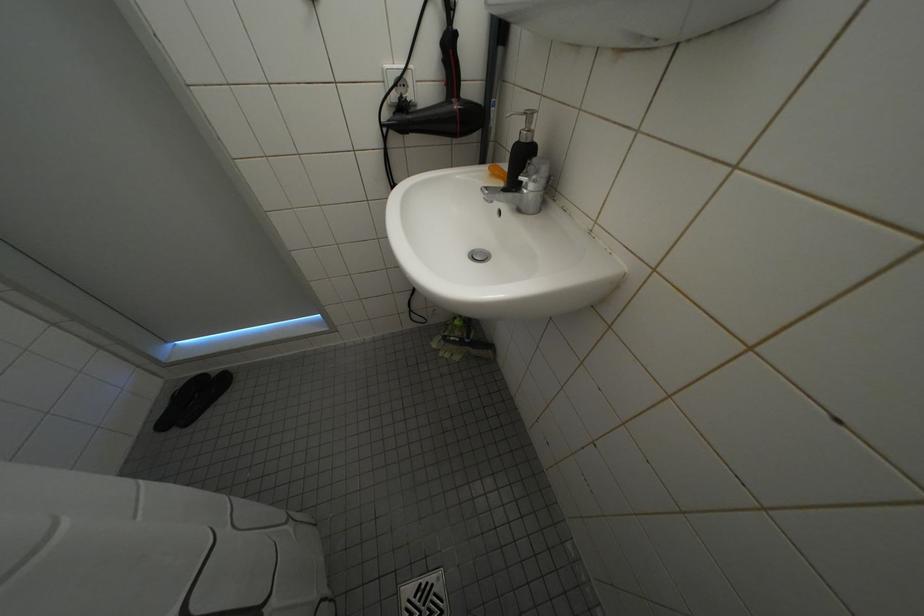
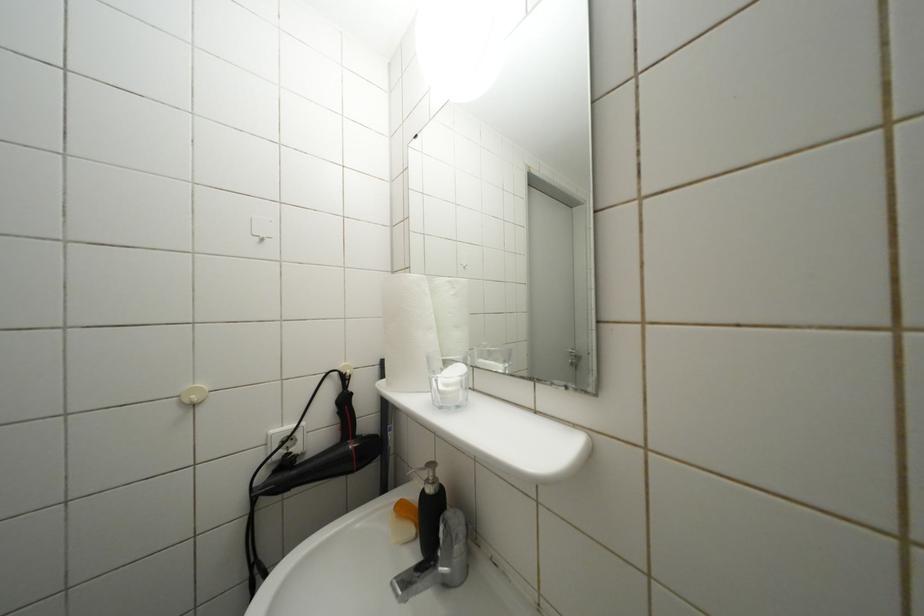
Based on the continuous images, in which direction is the camera rotating?

The rotation direction of the camera is right-up.